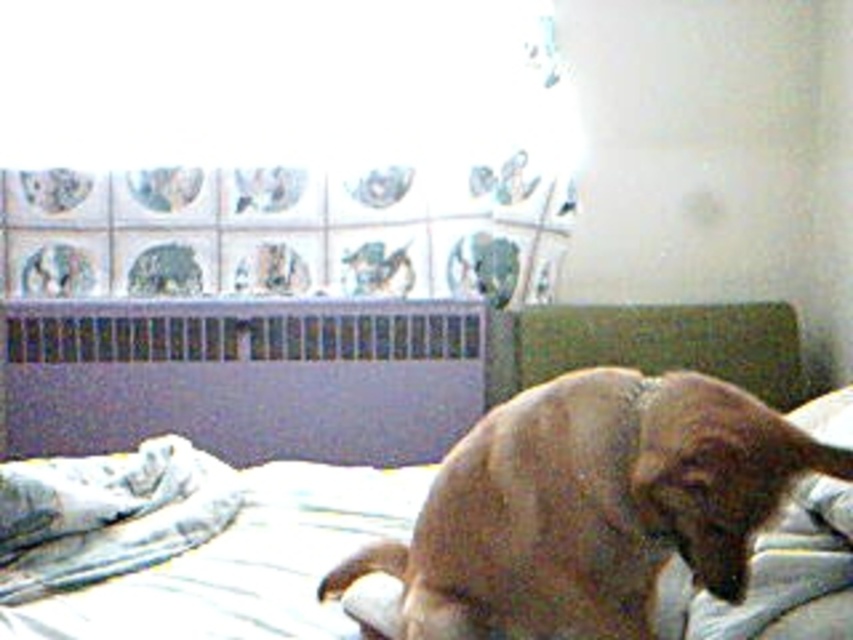
Who is more distant from viewer, (706, 552) or (91, 554)?

Positioned behind is point (91, 554).

Does brown furry dog at center appear on the right side of white soft blanket at lower left?

Correct, you'll find brown furry dog at center to the right of white soft blanket at lower left.

The image size is (853, 640). I want to click on brown furry dog at center, so click(585, 509).